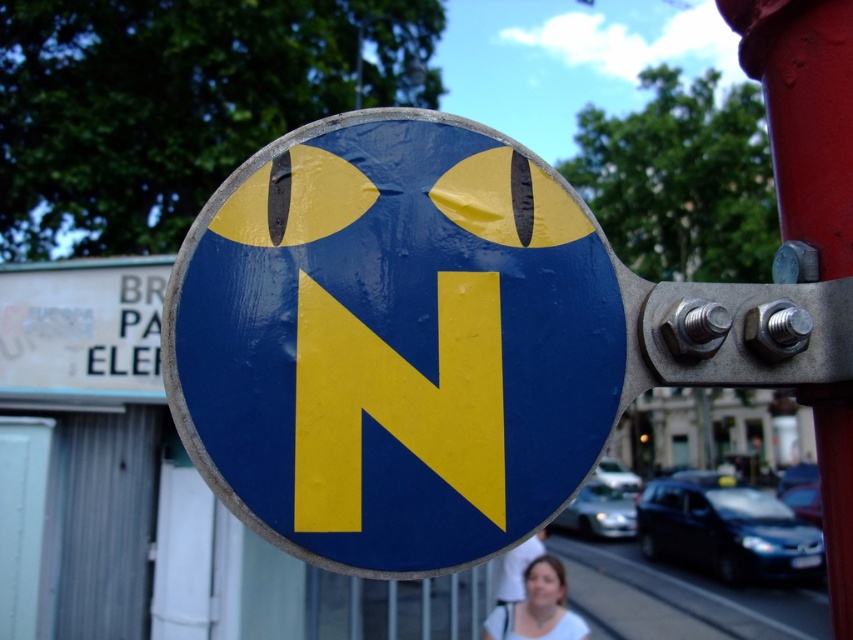
You are standing in front of a sign in an urban area. There is a point at coordinate (397,401). Is this point located on the yellow matte sign at center?

The yellow matte sign at center is represented by point (397,401), so yes, the point at coordinate (397,401) is located on the yellow matte sign at center.

You are a delivery driver approaching the sign and need to determine the correct direction. Since you can only see the matte blue sign at center and the yellow matte sign at center, which one is closer to you?

The matte blue sign at center is closer to you because it is in front of the yellow matte sign at center.

You are a photographer standing 3 feet away from the matte blue sign at center. You want to take a clear photo of the sign while keeping the blurred background. Is the current distance sufficient to ensure the sign is in focus?

The matte blue sign at center is 34.56 inches away from the camera. Since 34.56 inches is equal to 2.88 feet, which is less than 3 feet, the photographer is standing slightly farther away than the sign. To ensure the sign is in focus, the photographer should move closer to match the exact distance of 34.56 inches.